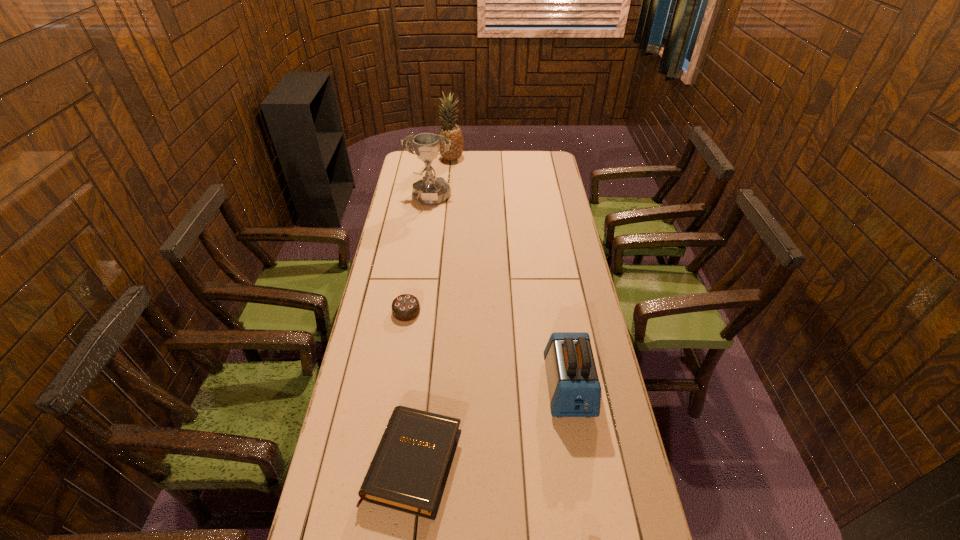
Locate an element on the screen. This screenshot has width=960, height=540. vacant area situated 0.290m on the back of the shortest object is located at coordinates (428, 334).

Locate an element on the screen. object positioned at the far edge is located at coordinates (451, 131).

Identify the location of award at the left edge. The image size is (960, 540). (429, 191).

Where is `chocolate cake situated at the left edge`? chocolate cake situated at the left edge is located at coordinates pyautogui.click(x=406, y=307).

Locate an element on the screen. The height and width of the screenshot is (540, 960). Bible that is at the left edge is located at coordinates (409, 471).

The height and width of the screenshot is (540, 960). What are the coordinates of `object located at the right edge` in the screenshot? It's located at (574, 389).

Where is `vacant region at the far edge`? This screenshot has width=960, height=540. vacant region at the far edge is located at coordinates (497, 152).

In order to click on free space at the left edge of the desktop in this screenshot , I will do `click(345, 497)`.

In order to click on vacant region at the right edge in this screenshot , I will do `click(579, 287)`.

Locate an element on the screen. empty location between the pineapple and the shortest object is located at coordinates pyautogui.click(x=433, y=311).